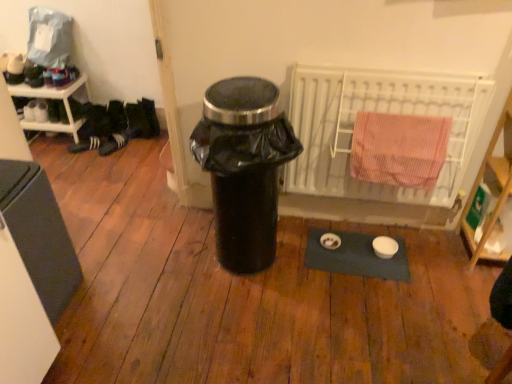
Image resolution: width=512 pixels, height=384 pixels. I want to click on vacant space behind matte gray refrigerator at left, so click(93, 235).